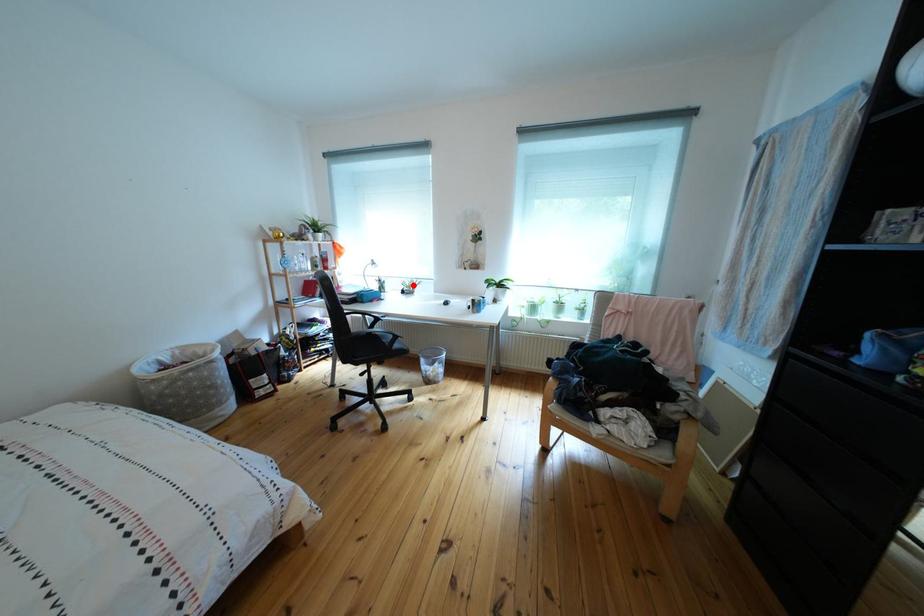
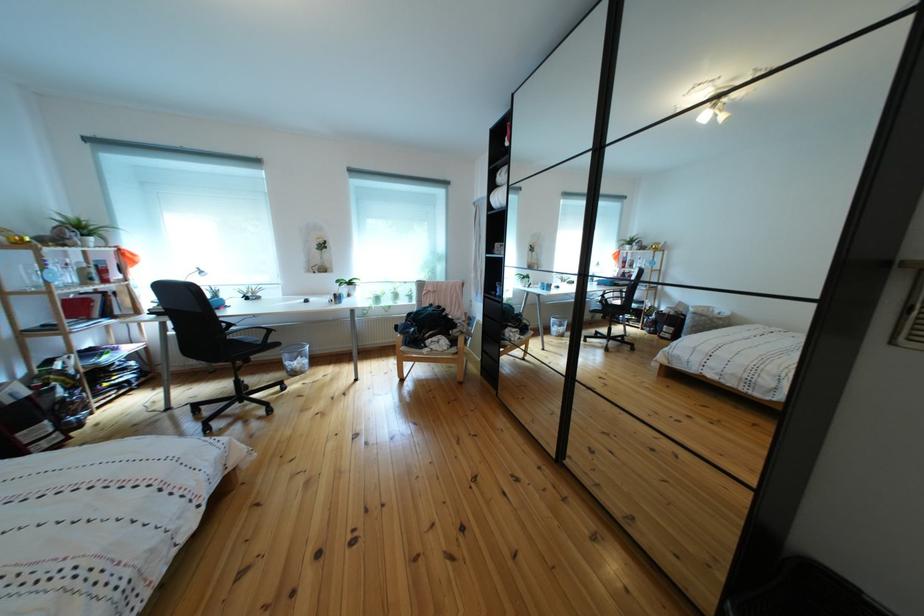
In the second image, find the point that corresponds to the highlighted location in the first image.

(247, 293)